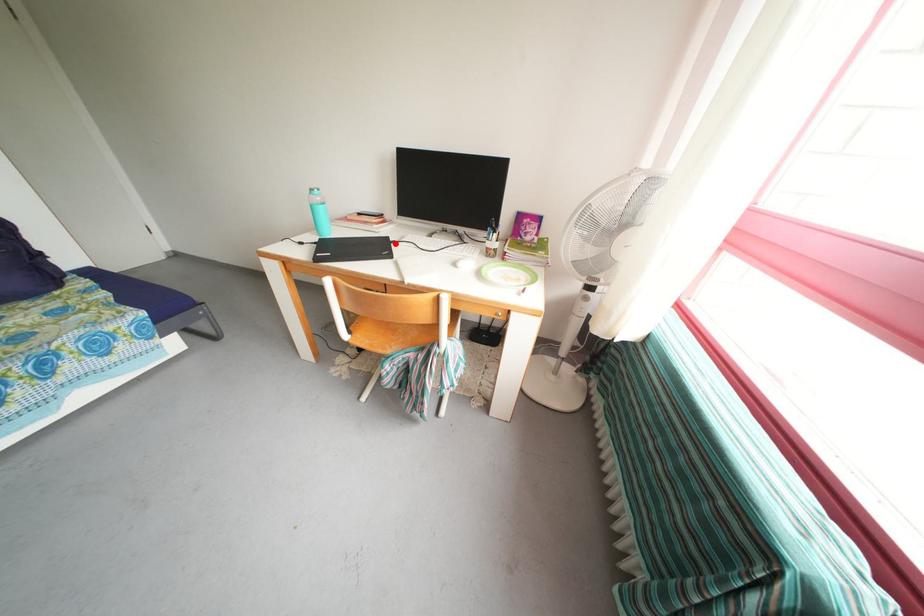
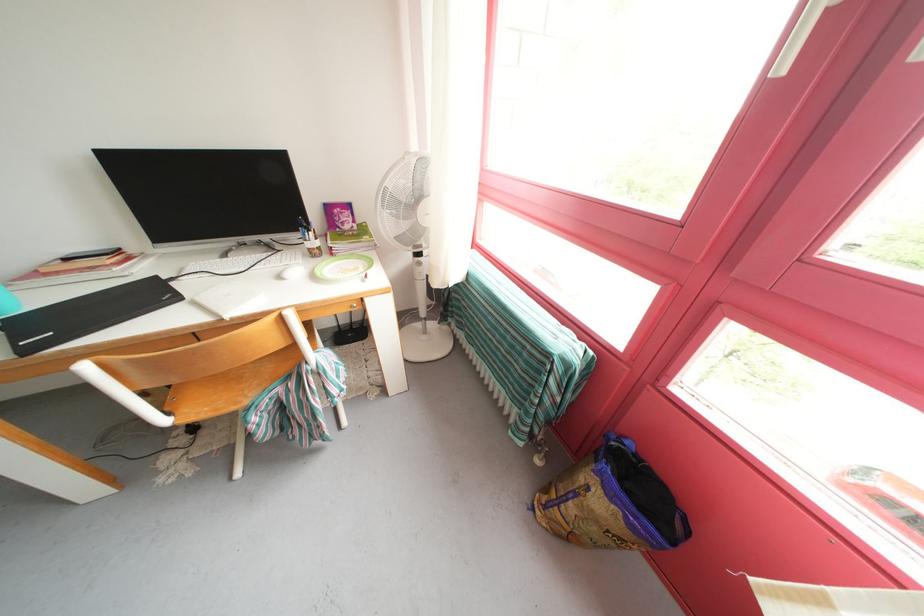
In the second image, find the point that corresponds to the highlighted location in the first image.

(164, 283)